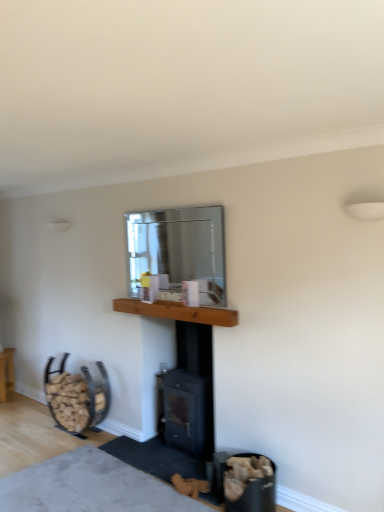
In order to click on free spot below wooden log basket at lower left (from a real-world perspective) in this screenshot , I will do `click(11, 396)`.